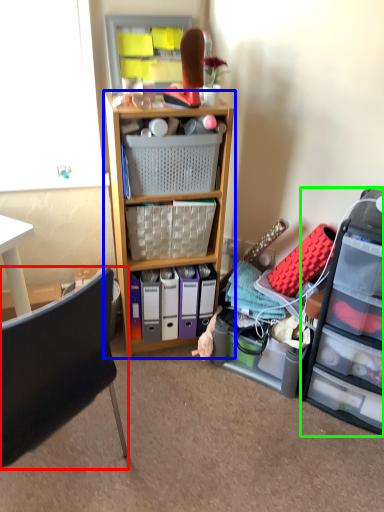
Question: Which is nearer to the chair (highlighted by a red box)? shelf (highlighted by a blue box) or file cabinet (highlighted by a green box).

Choices:
 (A) shelf
 (B) file cabinet

Answer: (A)